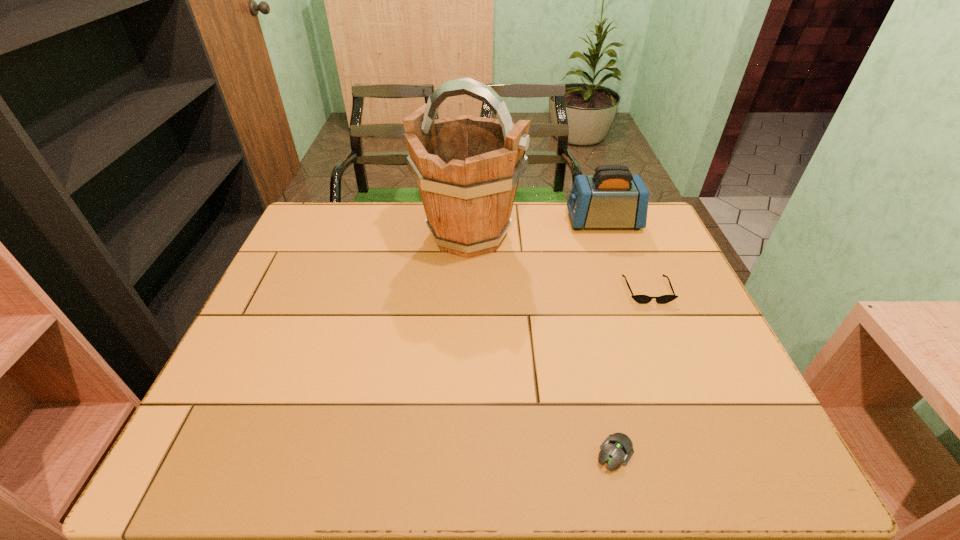
Where is `free space between the third tallest object and the leftmost object`? free space between the third tallest object and the leftmost object is located at coordinates (558, 262).

This screenshot has width=960, height=540. Identify the location of free spot between the third shortest object and the leftmost object. (536, 228).

The width and height of the screenshot is (960, 540). Identify the location of unoccupied area between the sunglasses and the toaster. (625, 256).

I want to click on free space between the nearest object and the toaster, so click(609, 338).

Select which object appears as the second closest to the toaster. Please provide its 2D coordinates. Your answer should be formatted as a tuple, i.e. [(x, y)], where the tuple contains the x and y coordinates of a point satisfying the conditions above.

[(641, 299)]

This screenshot has width=960, height=540. In order to click on object that is the second closest to the third shortest object in this screenshot , I will do 641,299.

Locate an element on the screen. The width and height of the screenshot is (960, 540). free space that satisfies the following two spatial constraints: 1. on the front side of the leftmost object; 2. on the left side of the shortest object is located at coordinates (462, 454).